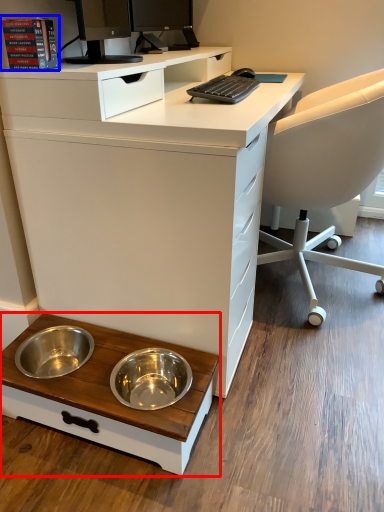
Question: Which object appears farthest to the camera in this image, table (highlighted by a red box) or book (highlighted by a blue box)?

Choices:
 (A) table
 (B) book

Answer: (A)